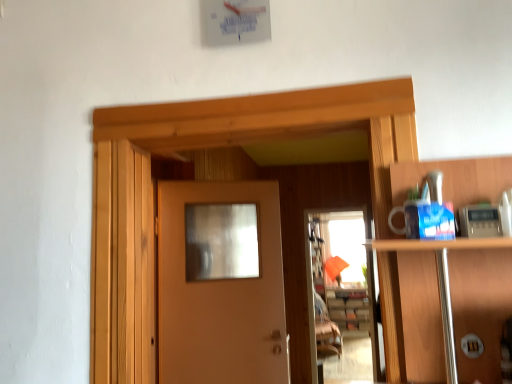
Question: Is translucent glass screen door at center outside of wooden cabinet at center?

Choices:
 (A) yes
 (B) no

Answer: (A)

Question: From the image's perspective, does translucent glass screen door at center appear lower than wooden cabinet at center?

Choices:
 (A) yes
 (B) no

Answer: (B)

Question: Is translucent glass screen door at center at the left side of wooden cabinet at center?

Choices:
 (A) no
 (B) yes

Answer: (B)

Question: Is translucent glass screen door at center looking in the opposite direction of wooden cabinet at center?

Choices:
 (A) no
 (B) yes

Answer: (B)

Question: Considering the relative sizes of translucent glass screen door at center and wooden cabinet at center in the image provided, is translucent glass screen door at center wider than wooden cabinet at center?

Choices:
 (A) no
 (B) yes

Answer: (A)

Question: Considering the positions of matte wood door at center and translucent glass screen door at center in the image, is matte wood door at center taller or shorter than translucent glass screen door at center?

Choices:
 (A) short
 (B) tall

Answer: (A)

Question: Considering the positions of point (164, 370) and point (354, 354), is point (164, 370) closer or farther from the camera than point (354, 354)?

Choices:
 (A) closer
 (B) farther

Answer: (A)

Question: Is matte wood door at center inside or outside of translucent glass screen door at center?

Choices:
 (A) inside
 (B) outside

Answer: (B)

Question: Based on their sizes in the image, would you say matte wood door at center is bigger or smaller than translucent glass screen door at center?

Choices:
 (A) big
 (B) small

Answer: (B)

Question: Considering the positions of matte wood door at center and wooden cabinet at center in the image, is matte wood door at center wider or thinner than wooden cabinet at center?

Choices:
 (A) wide
 (B) thin

Answer: (B)

Question: Is matte wood door at center in front of or behind wooden cabinet at center in the image?

Choices:
 (A) front
 (B) behind

Answer: (A)

Question: From a real-world perspective, is matte wood door at center physically located above or below wooden cabinet at center?

Choices:
 (A) above
 (B) below

Answer: (A)

Question: From the image's perspective, is matte wood door at center above or below wooden cabinet at center?

Choices:
 (A) below
 (B) above

Answer: (B)

Question: In terms of height, does wooden cabinet at center look taller or shorter compared to matte wood door at center?

Choices:
 (A) tall
 (B) short

Answer: (B)

Question: Considering the positions of point (362, 294) and point (264, 248), is point (362, 294) closer or farther from the camera than point (264, 248)?

Choices:
 (A) farther
 (B) closer

Answer: (A)